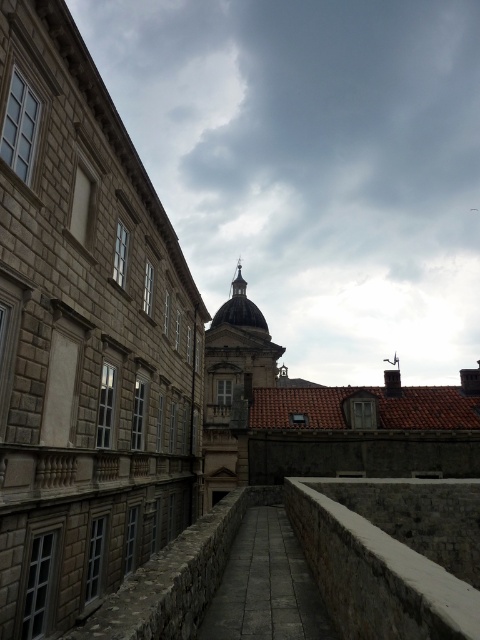
You are a tourist standing on the walkway and want to sit down to rest. There are two ledges available for sitting. The white stone ledge at center and the brown stone ledge at center. Which ledge can accommodate you better in terms of width?

The white stone ledge at center has a larger width than the brown stone ledge at center, so it can accommodate you better for sitting.

You are a tourist standing on the walkway in Dubrovnik and want to take a photo of both the white stone ledge at center and the brown stone ledge at center. Which ledge should you move towards to get a clearer view of the one that is closer?

You should move towards the white stone ledge at center because it is closer to the viewer than the brown stone ledge at center, so focusing on it will also capture the brown one in the background more clearly.

You are a tourist standing on the walkway in the historic city. You want to move from the white stone ledge at center to the brown stone ledge at center. Is the distance between them sufficient for you to walk directly from one to the other without needing to detour around any obstacles?

The distance between the white stone ledge at center and the brown stone ledge at center is 16.15 feet, which is a reasonable distance for a person to walk directly between them without needing to detour around obstacles.